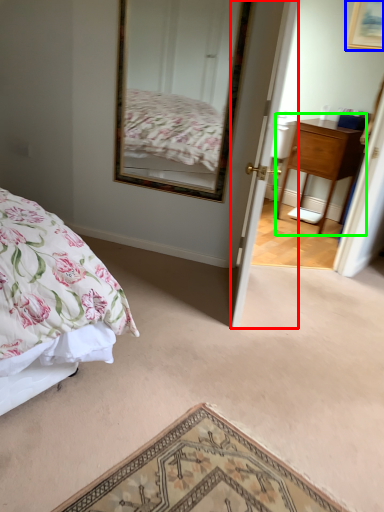
Question: Which object is positioned closest to door (highlighted by a red box)? Select from picture frame (highlighted by a blue box) and nightstand (highlighted by a green box).

Choices:
 (A) picture frame
 (B) nightstand

Answer: (B)